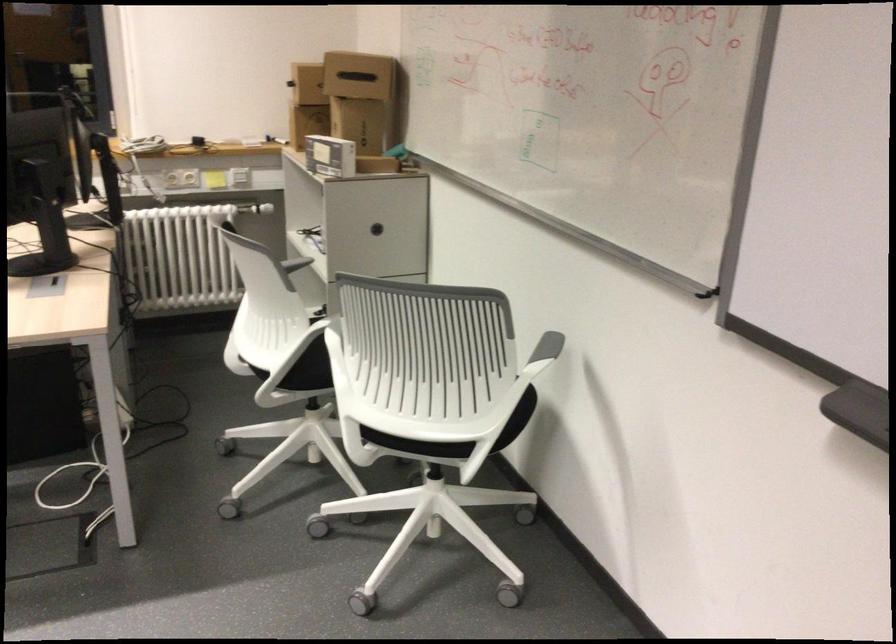
Describe the element at coordinates (858, 411) in the screenshot. Image resolution: width=896 pixels, height=644 pixels. I see `the whiteboard marker tray` at that location.